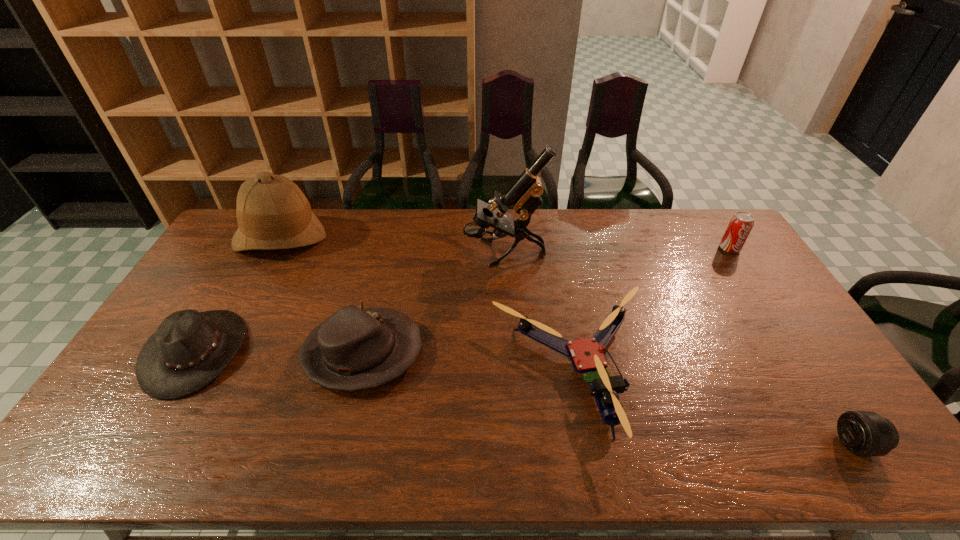
At what (x,y) coordinates should I click in order to perform the action: click on microscope. Please return your answer as a coordinate pair (x, y). Image resolution: width=960 pixels, height=540 pixels. Looking at the image, I should click on (524, 194).

What are the coordinates of `the tallest hat` in the screenshot? It's located at (272, 212).

Where is `the sixth shortest object`? the sixth shortest object is located at coordinates (272, 212).

Locate an element on the screen. The image size is (960, 540). soda can is located at coordinates (740, 225).

Find the location of a particular element. This screenshot has height=540, width=960. the rightmost hat is located at coordinates (354, 349).

Locate an element on the screen. The width and height of the screenshot is (960, 540). drone is located at coordinates (586, 355).

Identify the location of telephoto lens. (864, 433).

Where is `vacant space located 0.160m through the eyepiece of the tallest object`? The width and height of the screenshot is (960, 540). vacant space located 0.160m through the eyepiece of the tallest object is located at coordinates (420, 253).

I want to click on vacant position located through the eyepiece of the tallest object, so click(439, 253).

Locate an element on the screen. vacant space located through the eyepiece of the tallest object is located at coordinates (442, 253).